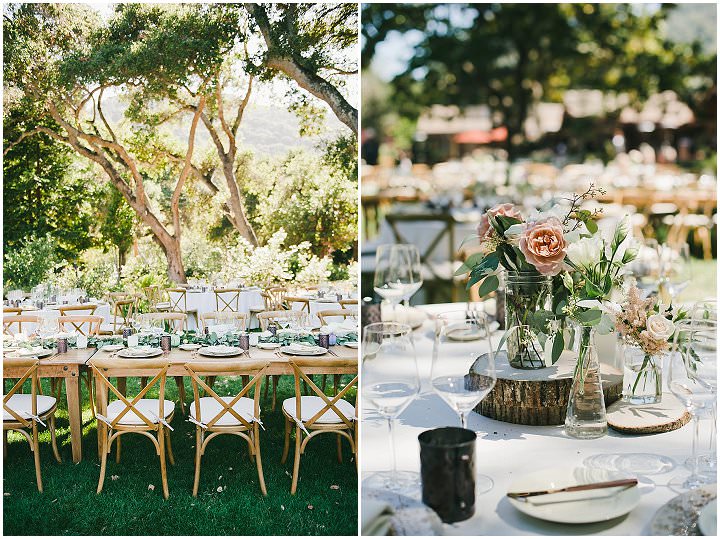
This screenshot has height=539, width=720. I want to click on table, so click(x=279, y=358).